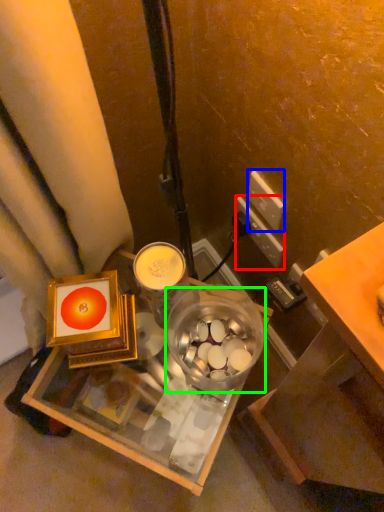
Question: Which object is positioned closest to power outlet (highlighted by a red box)? Select from power outlet (highlighted by a blue box) and glass bowl (highlighted by a green box).

Choices:
 (A) power outlet
 (B) glass bowl

Answer: (A)